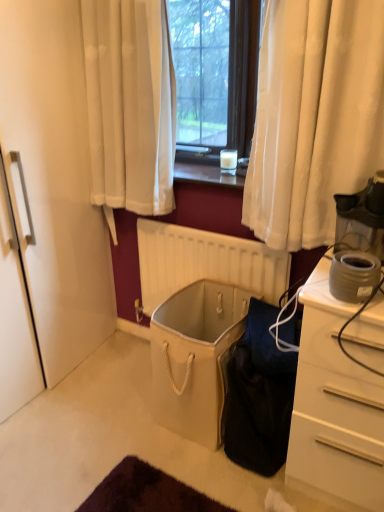
At what (x,y) coordinates should I click in order to perform the action: click on free space to the left of translucent glass coffee cup at center. Please return your answer as a coordinate pair (x, y). This screenshot has width=384, height=512. Looking at the image, I should click on pyautogui.click(x=196, y=167).